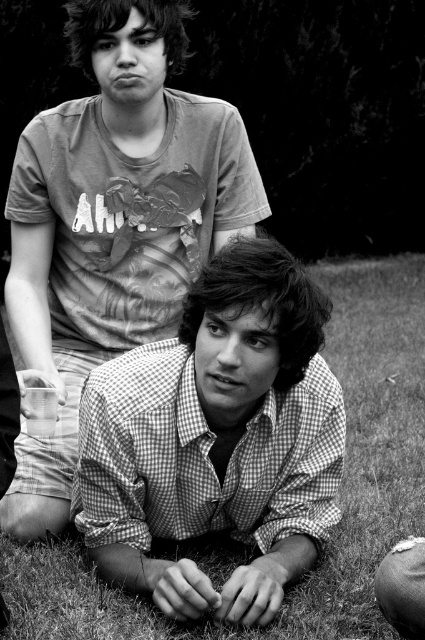
Is grassy lawn at lower center below metallic silver spoon at lower right?

Incorrect, grassy lawn at lower center is not positioned below metallic silver spoon at lower right.

What do you see at coordinates (340, 490) in the screenshot? I see `grassy lawn at lower center` at bounding box center [340, 490].

I want to click on grassy lawn at lower center, so (340, 490).

Is point (16, 300) closer to viewer compared to point (176, 552)?

No, (16, 300) is behind (176, 552).

Is checkered fabric shirt at lower center thinner than grassy lawn at lower center?

Incorrect, checkered fabric shirt at lower center's width is not less than grassy lawn at lower center's.

Image resolution: width=425 pixels, height=640 pixels. I want to click on checkered fabric shirt at lower center, so click(113, 221).

Who is more distant from viewer, (90,100) or (391,600)?

Point (90,100)

Does checkered fabric shirt at lower center have a larger size compared to metallic silver spoon at lower right?

Correct, checkered fabric shirt at lower center is larger in size than metallic silver spoon at lower right.

The height and width of the screenshot is (640, 425). I want to click on checkered fabric shirt at lower center, so point(113,221).

Find the location of a particular element. The height and width of the screenshot is (640, 425). checkered fabric shirt at lower center is located at coordinates (113, 221).